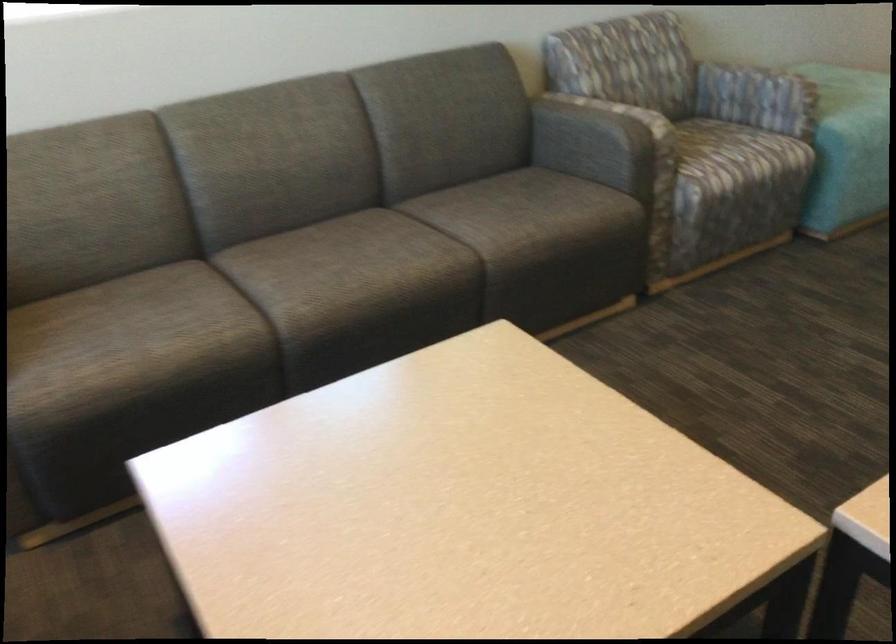
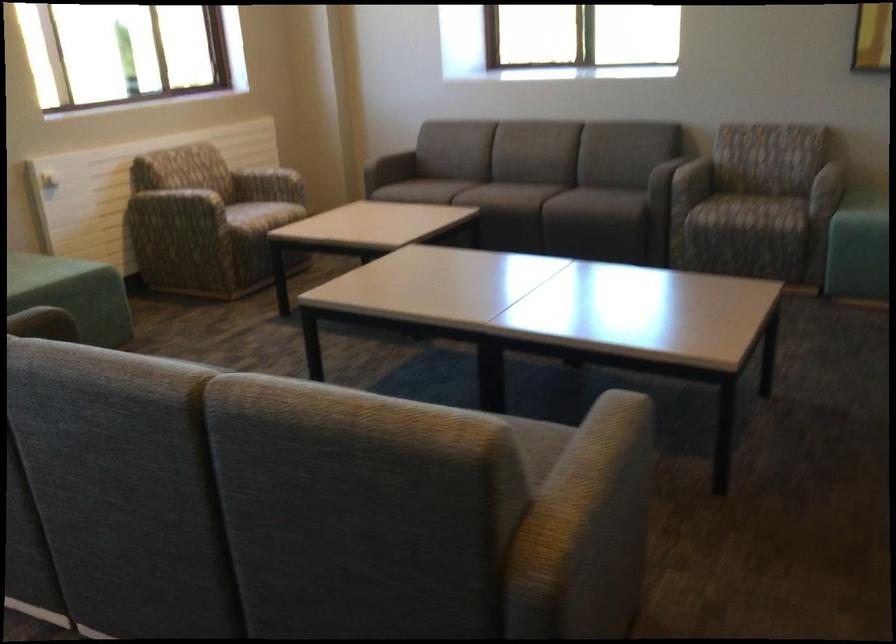
In the second image, find the point that corresponds to (204,292) in the first image.

(455, 187)